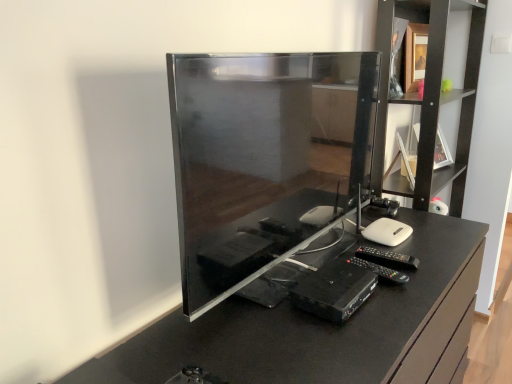
This screenshot has width=512, height=384. Identify the location of vacant area that is in front of black plastic dvd player at center. (344, 342).